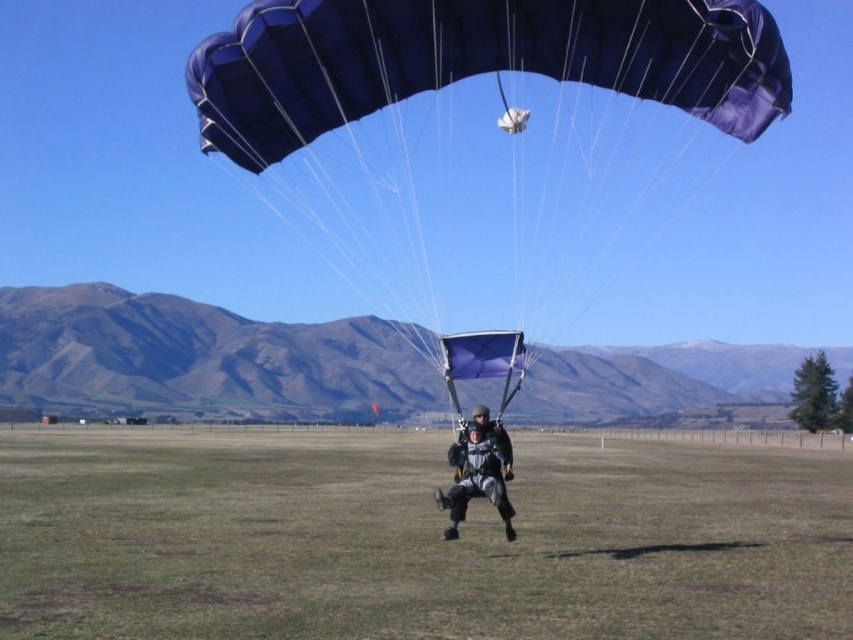
Question: Does blue fabric parachute at center have a lesser width compared to black fabric parachute at center?

Choices:
 (A) yes
 (B) no

Answer: (B)

Question: Which of these objects is positioned closest to the blue fabric parachute at center?

Choices:
 (A) green grass at center
 (B) black fabric parachute at center

Answer: (A)

Question: Can you confirm if green grass at center is positioned above blue fabric parachute at center?

Choices:
 (A) no
 (B) yes

Answer: (A)

Question: Which object appears farthest from the camera in this image?

Choices:
 (A) green grass at center
 (B) blue fabric parachute at center

Answer: (B)

Question: Can you confirm if blue fabric parachute at center is wider than black fabric parachute at center?

Choices:
 (A) yes
 (B) no

Answer: (A)

Question: Which object appears farthest from the camera in this image?

Choices:
 (A) black fabric parachute at center
 (B) green grass at center
 (C) blue fabric parachute at center

Answer: (A)